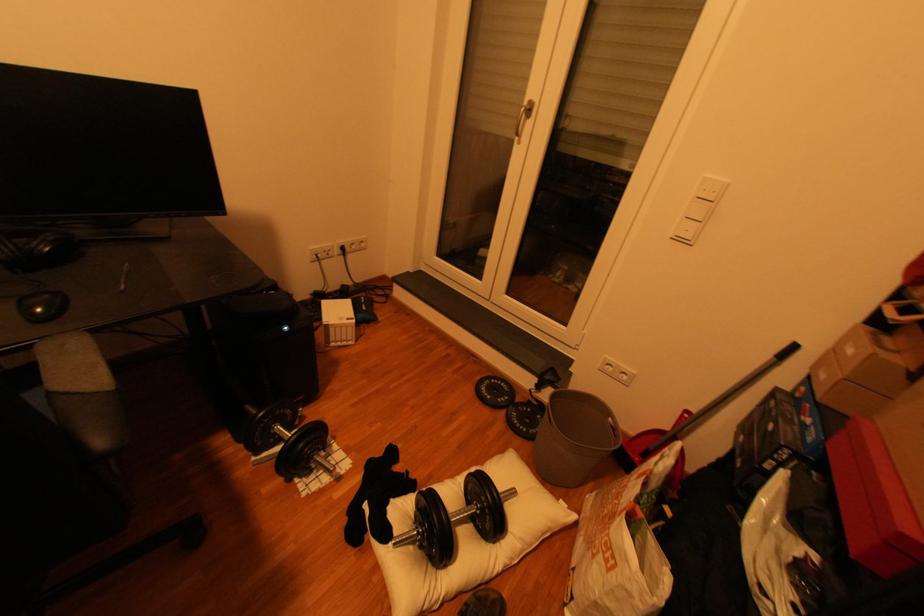
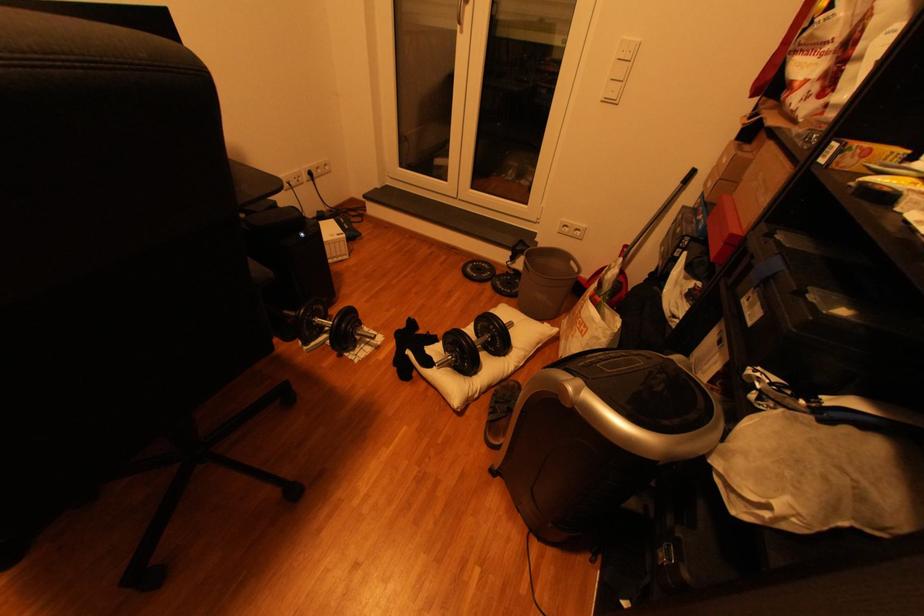
Locate, in the second image, the point that corresponds to the point at 535,430 in the first image.

(518, 292)